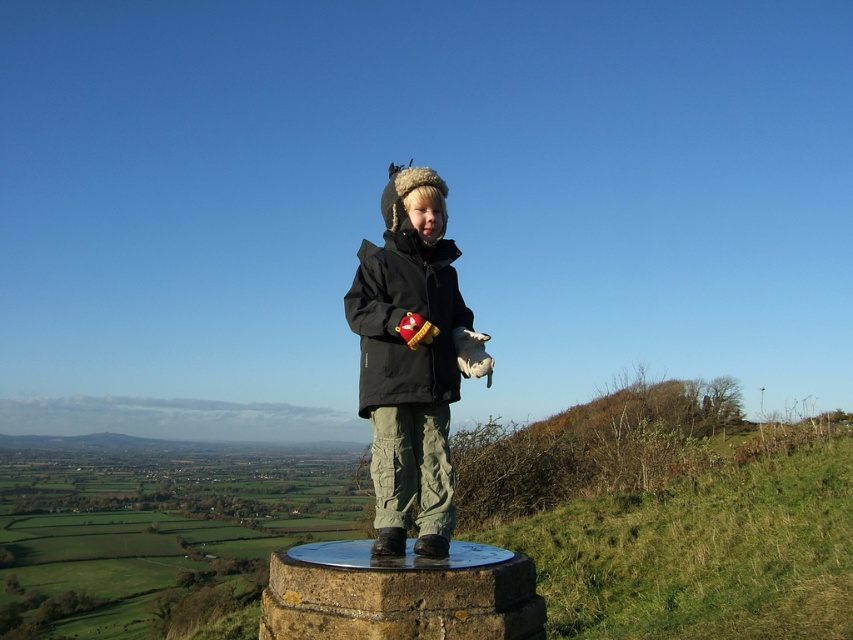
Question: Which point appears closest to the camera in this image?

Choices:
 (A) (436, 330)
 (B) (486, 564)

Answer: (B)

Question: Where is stone at center located in relation to black synthetic jacket at center in the image?

Choices:
 (A) above
 (B) below

Answer: (B)

Question: Is stone at center closer to camera compared to black synthetic jacket at center?

Choices:
 (A) no
 (B) yes

Answer: (B)

Question: Does stone at center appear on the left side of black synthetic jacket at center?

Choices:
 (A) yes
 (B) no

Answer: (B)

Question: Among these objects, which one is nearest to the camera?

Choices:
 (A) black synthetic jacket at center
 (B) stone at center

Answer: (B)